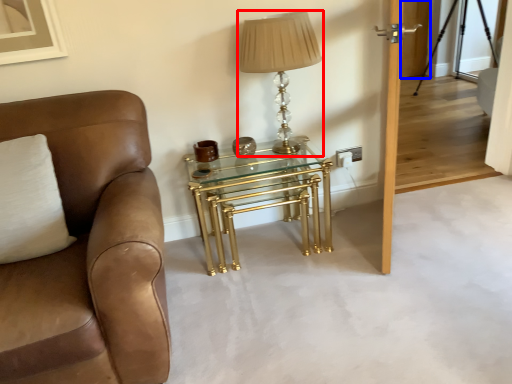
Question: Which object is further to the camera taking this photo, table lamp (highlighted by a red box) or glass door (highlighted by a blue box)?

Choices:
 (A) table lamp
 (B) glass door

Answer: (B)